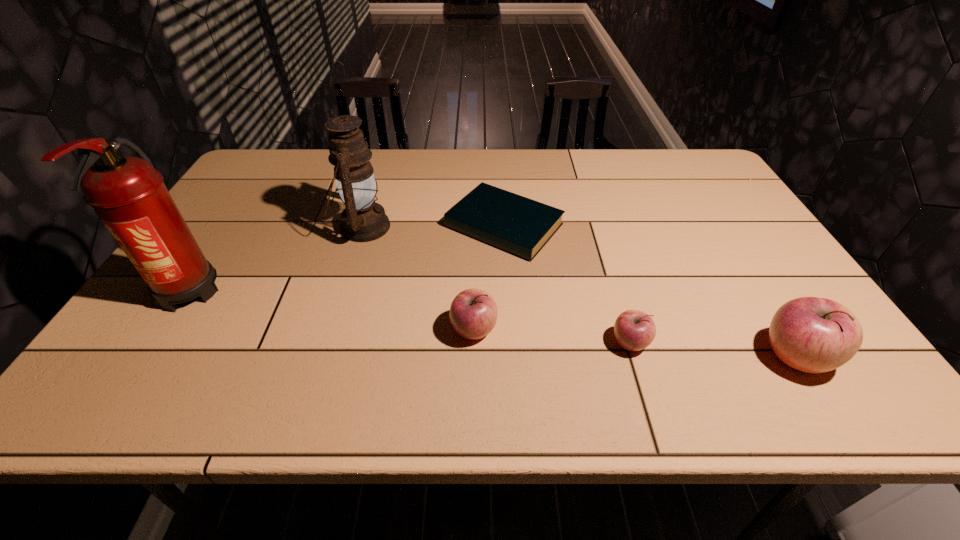
With all apples evenly spaced, where should an extra apple be placed on the left to continue the pattern? Please point out a vacant space. Please provide its 2D coordinates. Your answer should be formatted as a tuple, i.e. [(x, y)], where the tuple contains the x and y coordinates of a point satisfying the conditions above.

[(326, 318)]